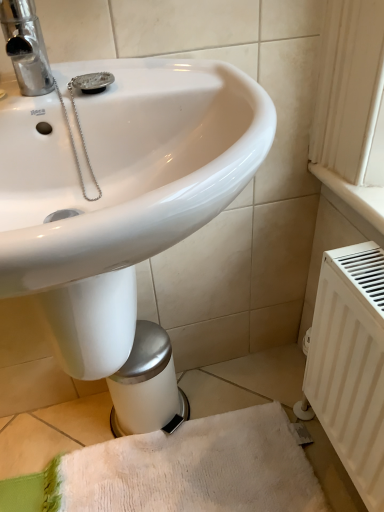
This screenshot has height=512, width=384. Describe the element at coordinates (192, 469) in the screenshot. I see `white textured bath towel at lower center` at that location.

In order to click on white textured bath towel at lower center in this screenshot , I will do `click(192, 469)`.

In order to face white matte radiator at right, should I rotate leftwards or rightwards?

You should look right and rotate roughly 21.506 degrees.

This screenshot has height=512, width=384. What do you see at coordinates (351, 362) in the screenshot?
I see `white matte radiator at right` at bounding box center [351, 362].

I want to click on white matte radiator at right, so click(351, 362).

You are a GUI agent. You are given a task and a screenshot of the screen. Output one action in this format:
    pyautogui.click(x=<x>, y=<y>)
    Task: Click on the white textured bath towel at lower center
    The width and height of the screenshot is (384, 512).
    Given the screenshot: What is the action you would take?
    pyautogui.click(x=192, y=469)

Which is more to the right, white textured bath towel at lower center or white matte radiator at right?

Positioned to the right is white matte radiator at right.

Considering the positions of objects white textured bath towel at lower center and white matte radiator at right in the image provided, who is behind, white textured bath towel at lower center or white matte radiator at right?

white textured bath towel at lower center is further away from the camera.

Does point (205, 465) appear closer or farther from the camera than point (350, 293)?

Point (205, 465) appears to be farther away from the viewer than point (350, 293).

From the image's perspective, who appears lower, white textured bath towel at lower center or white matte radiator at right?

white textured bath towel at lower center, from the image's perspective.

From a real-world perspective, is white textured bath towel at lower center positioned above or below white matte radiator at right?

Clearly, from a real-world perspective, white textured bath towel at lower center is below white matte radiator at right.

Can you confirm if white textured bath towel at lower center is wider than white matte radiator at right?

Yes, white textured bath towel at lower center is wider than white matte radiator at right.

Does white textured bath towel at lower center have a greater height compared to white matte radiator at right?

No, white textured bath towel at lower center is not taller than white matte radiator at right.

Considering the relative sizes of white textured bath towel at lower center and white matte radiator at right in the image provided, is white textured bath towel at lower center bigger than white matte radiator at right?

Incorrect, white textured bath towel at lower center is not larger than white matte radiator at right.

Can white matte radiator at right be found inside white textured bath towel at lower center?

No, white matte radiator at right is not surrounded by white textured bath towel at lower center.

Is white textured bath towel at lower center positioned far away from white matte radiator at right?

No.

Is white textured bath towel at lower center turned away from white matte radiator at right?

Yes, white textured bath towel at lower center's orientation is away from white matte radiator at right.

Identify the location of bath towel beneath the white matte radiator at right (from a real-world perspective). (192, 469).

Which object is positioned more to the right, white matte radiator at right or white textured bath towel at lower center?

Positioned to the right is white matte radiator at right.

Relative to white textured bath towel at lower center, is white matte radiator at right in front or behind?

white matte radiator at right is positioned closer to the viewer than white textured bath towel at lower center.

Between point (327, 411) and point (133, 439), which one is positioned in front?

Point (327, 411)

From the image's perspective, which object appears higher, white matte radiator at right or white textured bath towel at lower center?

white matte radiator at right.

From a real-world perspective, is white matte radiator at right positioned under white textured bath towel at lower center based on gravity?

No, from a real-world perspective, white matte radiator at right is not beneath white textured bath towel at lower center.

Based on the photo, considering the relative sizes of white matte radiator at right and white textured bath towel at lower center in the image provided, is white matte radiator at right thinner than white textured bath towel at lower center?

Yes, white matte radiator at right is thinner than white textured bath towel at lower center.

Considering the relative sizes of white matte radiator at right and white textured bath towel at lower center in the image provided, is white matte radiator at right taller than white textured bath towel at lower center?

Indeed, white matte radiator at right has a greater height compared to white textured bath towel at lower center.

Is white matte radiator at right bigger than white textured bath towel at lower center?

Indeed, white matte radiator at right has a larger size compared to white textured bath towel at lower center.

Choose the correct answer: Is white matte radiator at right inside white textured bath towel at lower center or outside it?

white matte radiator at right is located beyond the bounds of white textured bath towel at lower center.

Is white matte radiator at right far from white textured bath towel at lower center?

They are positioned close to each other.

Is white matte radiator at right oriented away from white textured bath towel at lower center?

No, white matte radiator at right is not facing away from white textured bath towel at lower center.

What are the coordinates of `bath towel behind the white matte radiator at right` in the screenshot? It's located at (192, 469).

I want to click on radiator located above the white textured bath towel at lower center (from a real-world perspective), so click(x=351, y=362).

Locate an element on the screen. This screenshot has width=384, height=512. bath towel beneath the white matte radiator at right (from a real-world perspective) is located at coordinates (192, 469).